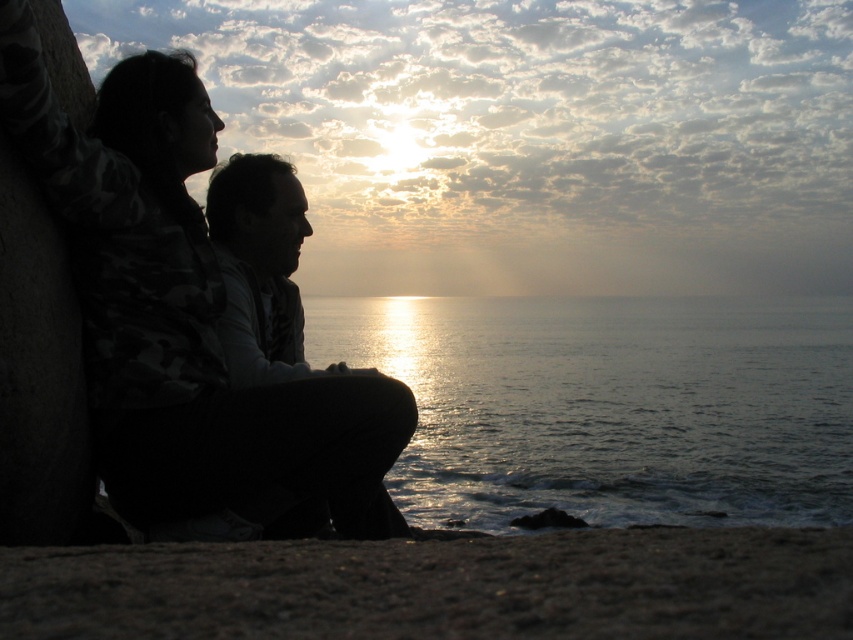
From the picture: You are a photographer trying to capture the sunset scene. You want to ensure the silhouette man at center is in focus while the glistening silver water at center is slightly blurred in the background. Is this possible based on their positions?

The silhouette man at center is behind the glistening silver water at center, so if you focus on the silhouette man at center, the glistening silver water at center would be in front and might not blur as it is closer to the camera. Adjust your focus or use a different technique to achieve the desired effect.

You are a photographer trying to capture the sunset scene. You notice the glistening silver water at center and the silhouette clothing at left in your viewfinder. Based on their positions, which object appears larger in the photo?

The glistening silver water at center appears larger in the photo because it is much taller than the silhouette clothing at left.